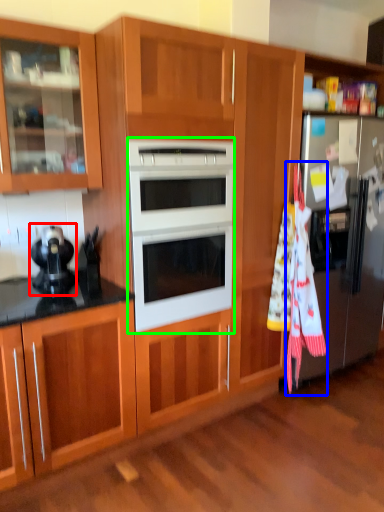
Question: Based on their relative distances, which object is nearer to appliance (highlighted by a red box)? Choose from beach towel (highlighted by a blue box) and microwave oven (highlighted by a green box).

Choices:
 (A) beach towel
 (B) microwave oven

Answer: (B)